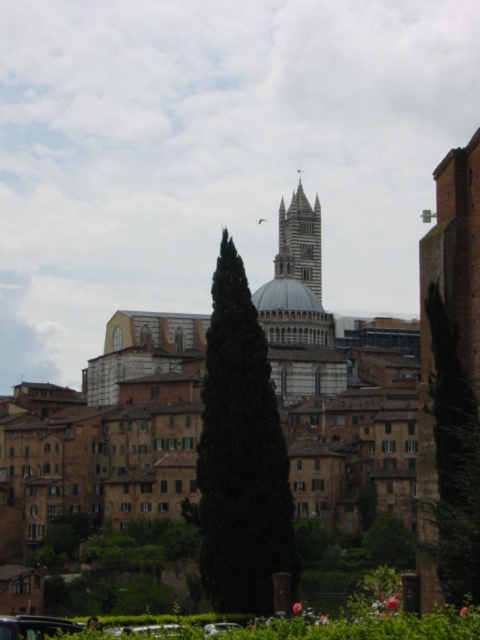
Who is taller, green matte tree at center or clear glass car at center?

green matte tree at center is taller.

Who is more distant from viewer, (240, 595) or (224, 625)?

Point (240, 595)

Where is `green matte tree at center`? green matte tree at center is located at coordinates (240, 454).

At what (x,y) coordinates should I click in order to perform the action: click on green matte tree at center. Please return your answer as a coordinate pair (x, y). Looking at the image, I should click on (240, 454).

Does green leafy tree at center appear on the right side of white stone tower at center?

Indeed, green leafy tree at center is positioned on the right side of white stone tower at center.

Who is more forward, (433, 410) or (278, 221)?

Point (433, 410) is in front.

Is point (460, 433) positioned behind point (301, 188)?

No, it is not.

Where is `green leafy tree at center`? green leafy tree at center is located at coordinates (454, 458).

Who is positioned more to the left, green leafy tree at center or metallic silver car at lower left?

metallic silver car at lower left is more to the left.

Which is more to the right, green leafy tree at center or metallic silver car at lower left?

Positioned to the right is green leafy tree at center.

Between point (442, 376) and point (26, 628), which one is positioned in front?

Point (26, 628)

This screenshot has width=480, height=640. What are the coordinates of `green leafy tree at center` in the screenshot? It's located at (454, 458).